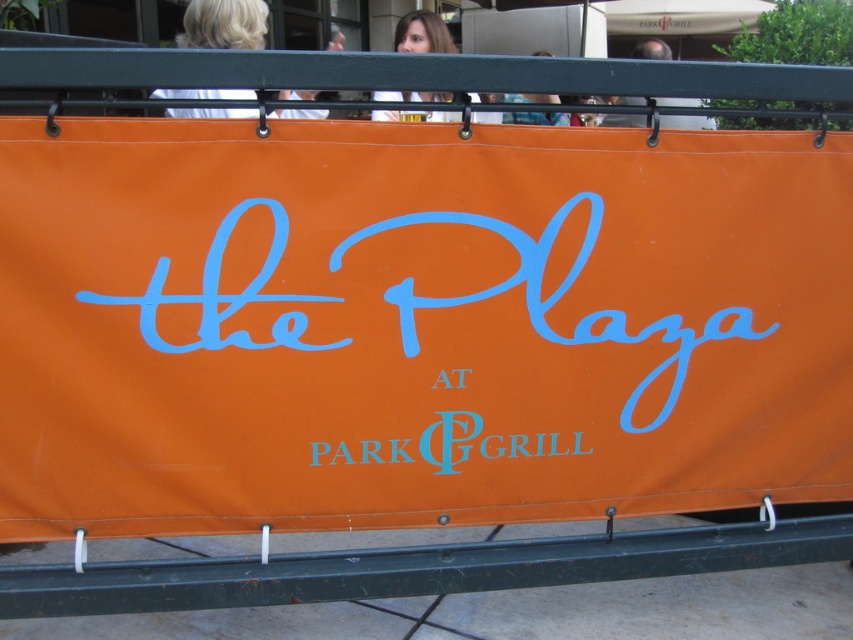
You are a photographer standing in front of the orange banner. You notice the green metal rail at bottom and the smooth skin head at upper center. Which object is located to the left of the other?

The green metal rail at bottom is positioned on the left side of smooth skin head at upper center.

Looking at the banner on the dark green metal frame, can you tell me the position of the bluecursive text at center relative to the blonde hair at upper left?

The bluecursive text at center is below the blonde hair at upper left.